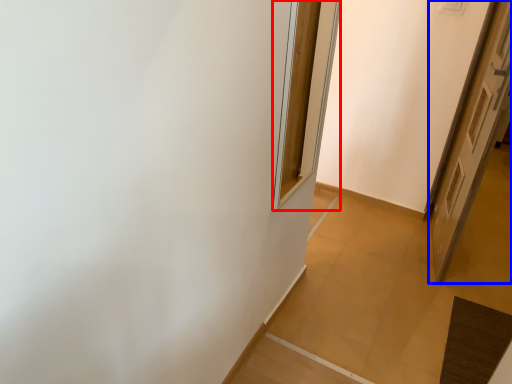
Question: Which object appears farthest to the camera in this image, window (highlighted by a red box) or door (highlighted by a blue box)?

Choices:
 (A) window
 (B) door

Answer: (B)